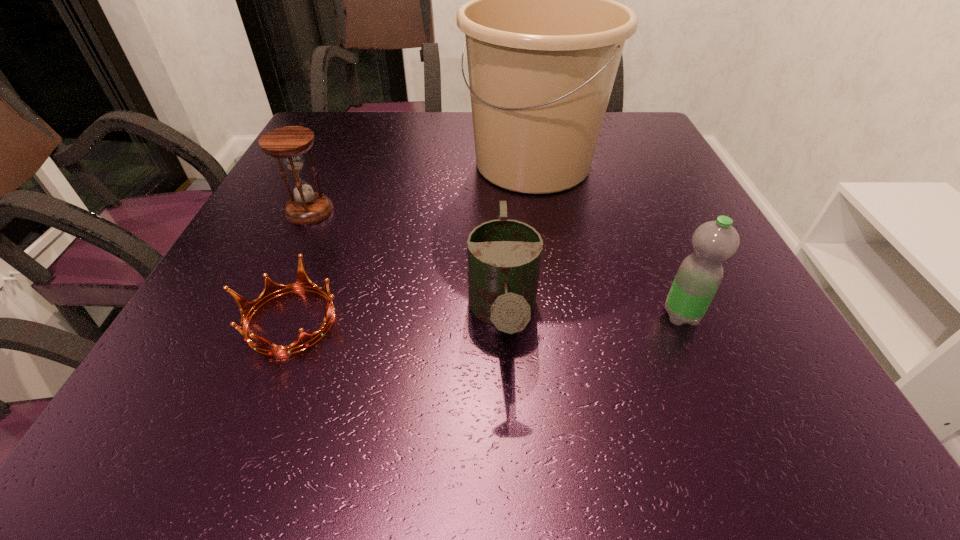
Where is `the tallest object`? This screenshot has width=960, height=540. the tallest object is located at coordinates (544, 37).

Image resolution: width=960 pixels, height=540 pixels. In order to click on water bottle in this screenshot , I will do `click(700, 274)`.

You are a GUI agent. You are given a task and a screenshot of the screen. Output one action in this format:
    pyautogui.click(x=<x>, y=<y>)
    Task: Click on the hourglass
    Image resolution: width=960 pixels, height=540 pixels.
    Given the screenshot: What is the action you would take?
    pyautogui.click(x=290, y=143)

The width and height of the screenshot is (960, 540). Identify the location of watering can. (504, 256).

What are the coordinates of `the shortest object` in the screenshot? It's located at (272, 289).

Image resolution: width=960 pixels, height=540 pixels. Find the location of `free space located 0.060m on the left of the bucket`. free space located 0.060m on the left of the bucket is located at coordinates [x=437, y=164].

Identify the location of vacant space situated 0.160m on the back of the water bottle. The height and width of the screenshot is (540, 960). (650, 242).

I want to click on vacant region located on the back of the hourglass, so click(330, 168).

At what (x,y) coordinates should I click in order to perform the action: click on vacant space situated with the spout on the watering can. Please return your answer as a coordinate pair (x, y). Looking at the image, I should click on (509, 436).

Identify the location of blank space located 0.080m on the left of the shortest object. Image resolution: width=960 pixels, height=540 pixels. coord(189,321).